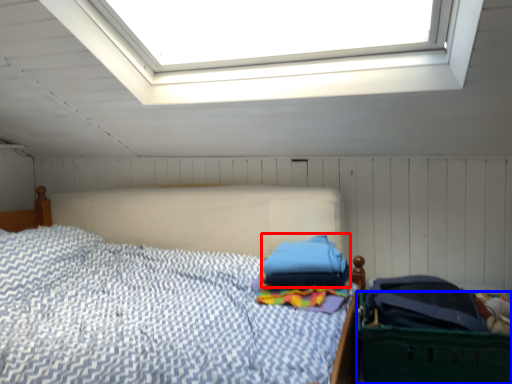
Question: Which of the following is the farthest to the observer, pillow (highlighted by a red box) or laundry basket (highlighted by a blue box)?

Choices:
 (A) pillow
 (B) laundry basket

Answer: (A)